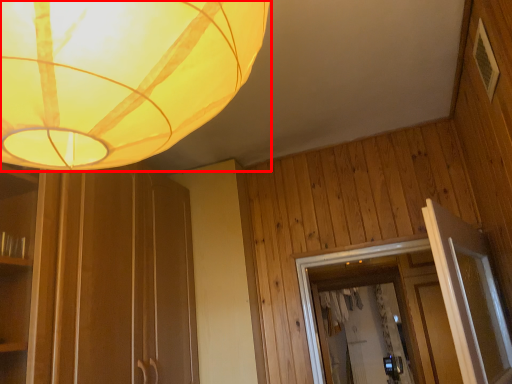
Question: From the image's perspective, where is lamp (annotated by the red box) located relative to panel?

Choices:
 (A) above
 (B) below

Answer: (B)